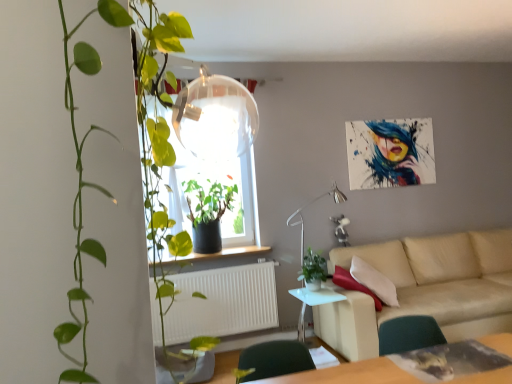
Question: Would you say smooth wooden window sill at center is part of white glossy side table at lower center's contents?

Choices:
 (A) no
 (B) yes

Answer: (A)

Question: Is white glossy side table at lower center looking in the opposite direction of smooth wooden window sill at center?

Choices:
 (A) yes
 (B) no

Answer: (B)

Question: From a real-world perspective, does white glossy side table at lower center sit lower than smooth wooden window sill at center?

Choices:
 (A) no
 (B) yes

Answer: (B)

Question: Is there a large distance between white glossy side table at lower center and smooth wooden window sill at center?

Choices:
 (A) no
 (B) yes

Answer: (A)

Question: From the image's perspective, is white glossy side table at lower center beneath smooth wooden window sill at center?

Choices:
 (A) yes
 (B) no

Answer: (A)

Question: Is beige fabric couch at lower right inside or outside of green glossy plant at left, which is the third houseplant from back to front?

Choices:
 (A) inside
 (B) outside

Answer: (B)

Question: From a real-world perspective, is beige fabric couch at lower right physically located above or below green glossy plant at left, which appears as the 1th houseplant when viewed from the front?

Choices:
 (A) below
 (B) above

Answer: (A)

Question: Would you say beige fabric couch at lower right is to the left or to the right of green glossy plant at left, which is the third houseplant from back to front, in the picture?

Choices:
 (A) left
 (B) right

Answer: (B)

Question: Based on their sizes in the image, would you say beige fabric couch at lower right is bigger or smaller than green glossy plant at left, which is the third houseplant from back to front?

Choices:
 (A) small
 (B) big

Answer: (B)

Question: From the image's perspective, is beige fabric couch at lower right positioned above or below white matte radiator at lower center?

Choices:
 (A) above
 (B) below

Answer: (A)

Question: Considering the relative positions of beige fabric couch at lower right and white matte radiator at lower center in the image provided, is beige fabric couch at lower right to the left or to the right of white matte radiator at lower center?

Choices:
 (A) left
 (B) right

Answer: (B)

Question: In terms of width, does beige fabric couch at lower right look wider or thinner when compared to white matte radiator at lower center?

Choices:
 (A) thin
 (B) wide

Answer: (B)

Question: From a real-world perspective, is beige fabric couch at lower right above or below white matte radiator at lower center?

Choices:
 (A) above
 (B) below

Answer: (B)

Question: From their relative heights in the image, would you say green glossy plant at left, which appears as the 1th houseplant when viewed from the front, is taller or shorter than white matte radiator at lower center?

Choices:
 (A) short
 (B) tall

Answer: (B)

Question: Looking at their shapes, would you say green glossy plant at left, which appears as the 1th houseplant when viewed from the front, is wider or thinner than white matte radiator at lower center?

Choices:
 (A) thin
 (B) wide

Answer: (B)